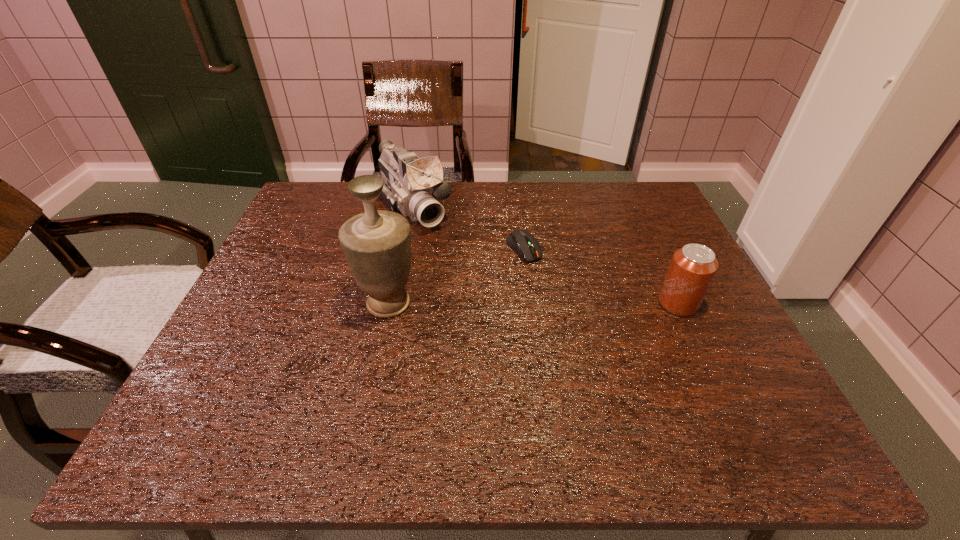
Image resolution: width=960 pixels, height=540 pixels. I want to click on vacant region between the third shortest object and the rightmost object, so point(544,255).

What are the coordinates of `object identified as the closest to the third tallest object` in the screenshot? It's located at (522, 242).

Select which object is the second closest to the shortest object. Please provide its 2D coordinates. Your answer should be formatted as a tuple, i.e. [(x, y)], where the tuple contains the x and y coordinates of a point satisfying the conditions above.

[(377, 243)]

Identify the location of vacant space that satisfies the following two spatial constraints: 1. on the back side of the tallest object; 2. on the right side of the third object from left to right. This screenshot has height=540, width=960. (400, 249).

Where is `blank area in the image that satisfies the following two spatial constraints: 1. on the front side of the camcorder; 2. on the left side of the rightmost object`? blank area in the image that satisfies the following two spatial constraints: 1. on the front side of the camcorder; 2. on the left side of the rightmost object is located at coordinates (392, 303).

At what (x,y) coordinates should I click in order to perform the action: click on free space that satisfies the following two spatial constraints: 1. on the back side of the camcorder; 2. on the right side of the urn. Please return your answer as a coordinate pair (x, y). Looking at the image, I should click on (409, 207).

This screenshot has width=960, height=540. Find the location of `vacant space that satisfies the following two spatial constraints: 1. on the front side of the second shortest object; 2. on the left side of the camcorder`. vacant space that satisfies the following two spatial constraints: 1. on the front side of the second shortest object; 2. on the left side of the camcorder is located at coordinates (392, 303).